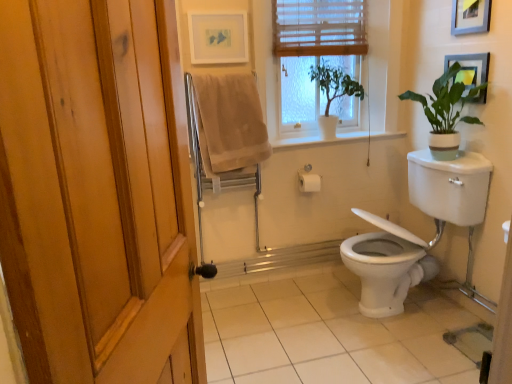
The image size is (512, 384). I want to click on vacant region above white tile at lower center (from a real-world perspective), so click(309, 333).